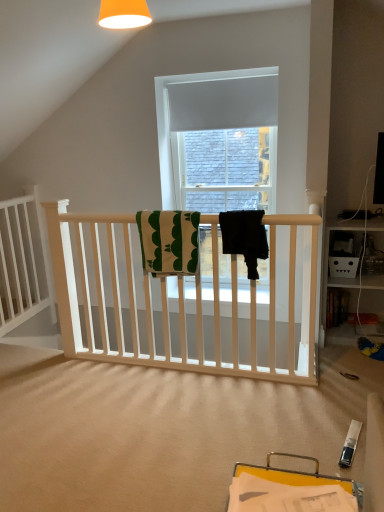
Question: From a real-world perspective, relative to green and white textured towel at center, the second beach towel when ordered from right to left, is black fabric towel at center, the 1th beach towel from the right, vertically above or below?

Choices:
 (A) below
 (B) above

Answer: (B)

Question: Considering their positions, is black fabric towel at center, the 1th beach towel from the right, located in front of or behind green and white textured towel at center, the second beach towel when ordered from right to left?

Choices:
 (A) behind
 (B) front

Answer: (B)

Question: Which of these objects is positioned closest to the white wooden bed frame at left?

Choices:
 (A) black fabric towel at center, the second beach towel in the left-to-right sequence
 (B) green and white textured towel at center, marked as the 1th beach towel in a left-to-right arrangement

Answer: (B)

Question: Which is nearer to the green and white textured towel at center, marked as the 1th beach towel in a left-to-right arrangement?

Choices:
 (A) white wooden bed frame at left
 (B) black fabric towel at center, the 1th beach towel from the right

Answer: (B)